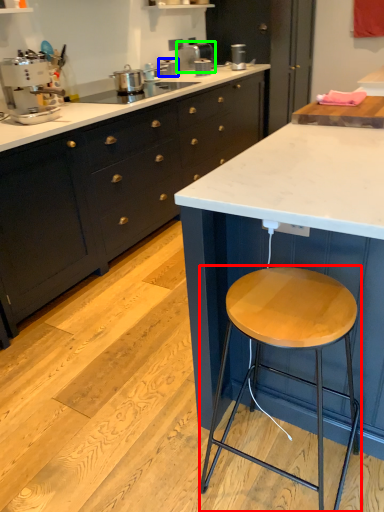
Question: Which object is the closest to the stool (highlighted by a red box)? Choose among these: appliance (highlighted by a blue box) or appliance (highlighted by a green box).

Choices:
 (A) appliance
 (B) appliance

Answer: (A)